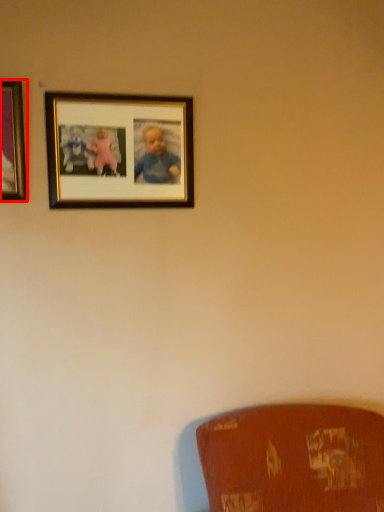
Question: From the image's perspective, what is the correct spatial positioning of picture frame (annotated by the red box) in reference to picture frame?

Choices:
 (A) below
 (B) above

Answer: (B)